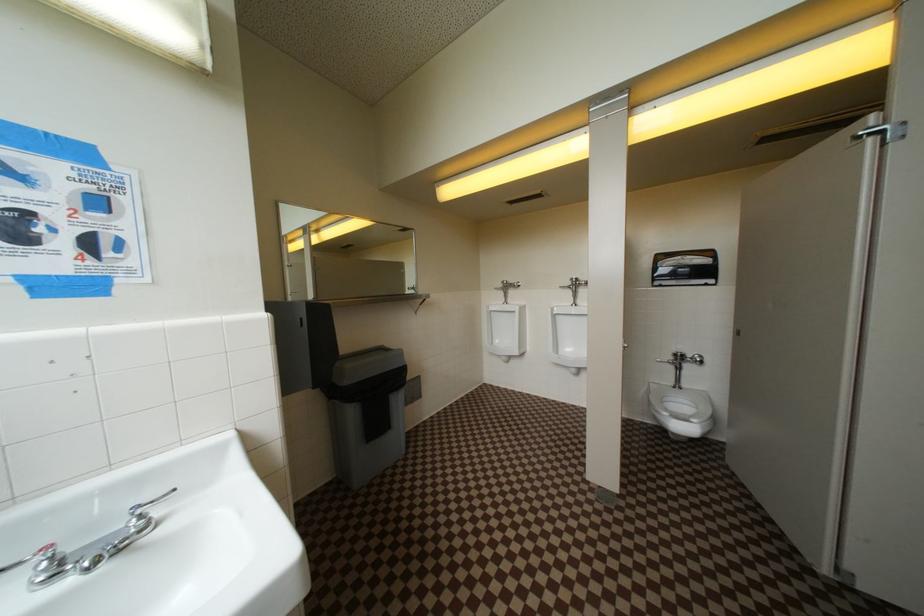
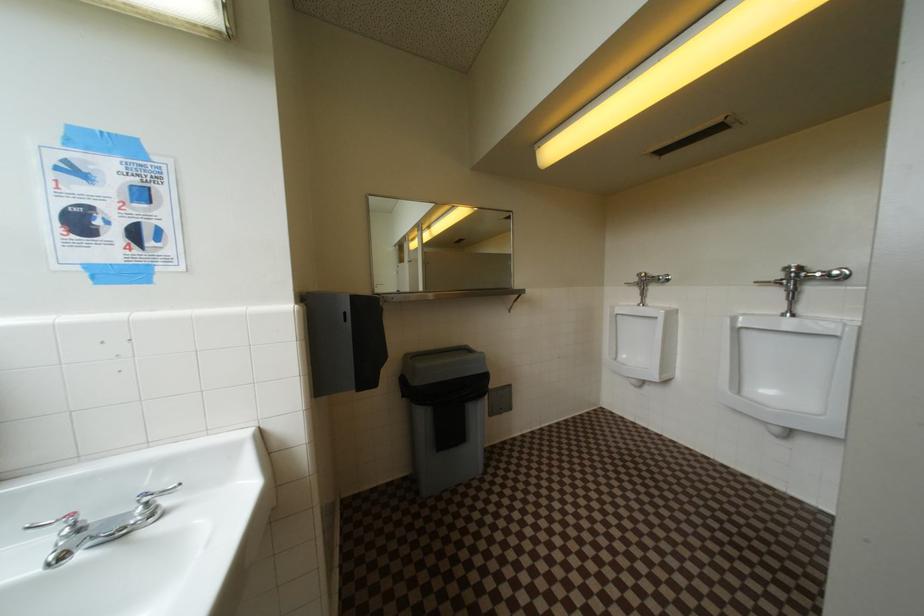
Question: Which direction would the cameraman need to move to produce the second image? Reply with the corresponding letter.

Choices:
 (A) Left
 (B) Right
 (C) Forward
 (D) Backward

Answer: (C)